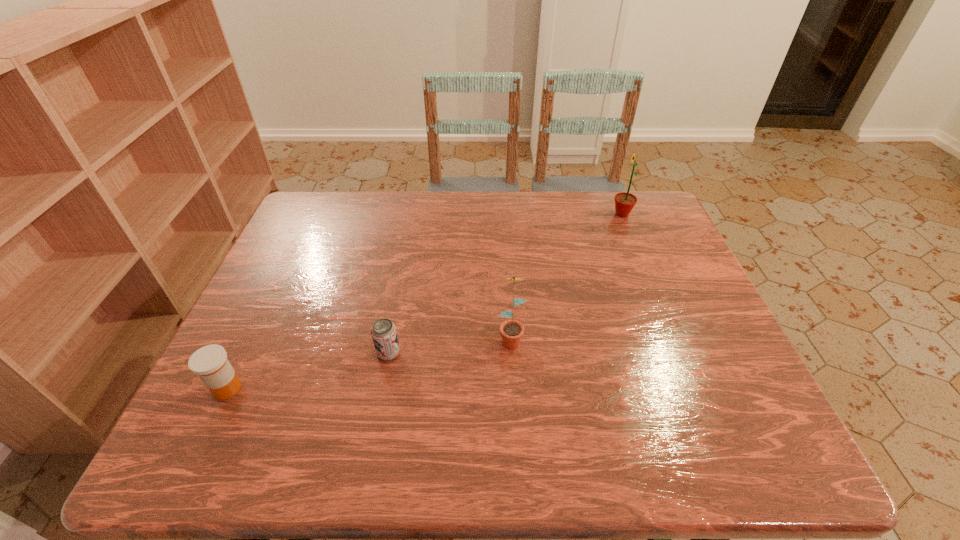
Identify the location of vacant space in between the nearer sunflower and the rightmost object. The width and height of the screenshot is (960, 540). (566, 275).

Where is `vacant area that lies between the third object from left to right and the third object from right to left`? vacant area that lies between the third object from left to right and the third object from right to left is located at coordinates (x=449, y=345).

Locate an element on the screen. free point between the rightmost object and the second object from left to right is located at coordinates (505, 284).

At what (x,y) coordinates should I click in order to perform the action: click on free space between the beer can and the nearest object. Please return your answer as a coordinate pair (x, y). This screenshot has height=540, width=960. Looking at the image, I should click on (308, 370).

What are the coordinates of `unoccupied area between the nearest object and the beer can` in the screenshot? It's located at (308, 370).

You are a GUI agent. You are given a task and a screenshot of the screen. Output one action in this format:
    pyautogui.click(x=<x>, y=<y>)
    Task: Click on the closest object to the nearest object
    The width and height of the screenshot is (960, 540).
    Given the screenshot: What is the action you would take?
    pyautogui.click(x=384, y=335)

Where is `object identified as the closest to the taller sunflower`? This screenshot has width=960, height=540. object identified as the closest to the taller sunflower is located at coordinates (511, 331).

Identify the location of free space in the image that satisfies the following two spatial constraints: 1. on the flower of the third object from left to right; 2. on the label of the medicine. This screenshot has width=960, height=540. (514, 388).

Where is `free region that satisfies the following two spatial constraints: 1. on the face of the taller sunflower; 2. on the flower of the third shortest object`? The height and width of the screenshot is (540, 960). free region that satisfies the following two spatial constraints: 1. on the face of the taller sunflower; 2. on the flower of the third shortest object is located at coordinates (672, 337).

Locate an element on the screen. This screenshot has height=540, width=960. vacant space that satisfies the following two spatial constraints: 1. on the face of the right sunflower; 2. on the flower of the second object from right to left is located at coordinates (672, 337).